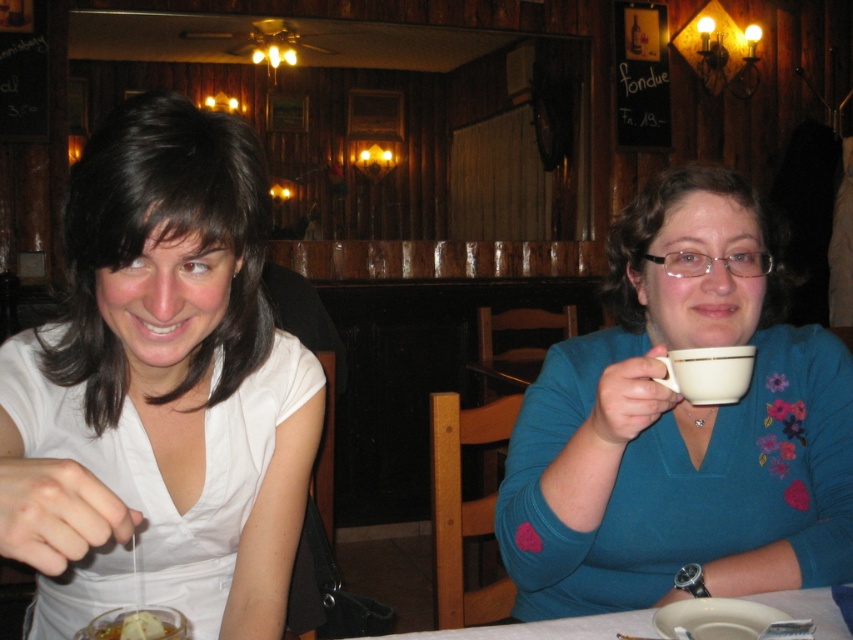
Question: Is white matte shirt at left below white porcelain mug at upper right?

Choices:
 (A) no
 (B) yes

Answer: (B)

Question: Which point is farther from the camera taking this photo?

Choices:
 (A) (822, 611)
 (B) (148, 609)
 (C) (152, 625)
 (D) (253, 541)

Answer: (D)

Question: Is white matte shirt at left below teal jersey at upper right?

Choices:
 (A) yes
 (B) no

Answer: (A)

Question: Which object appears closest to the camera in this image?

Choices:
 (A) white porcelain mug at upper right
 (B) white glossy table at lower center
 (C) translucent glass bowl at lower left

Answer: (C)

Question: Which point is farther to the camera?

Choices:
 (A) (467, 637)
 (B) (728, 388)
 (C) (67, 611)
 (D) (97, 621)

Answer: (C)

Question: Can you confirm if teal jersey at upper right is wider than white glossy table at lower center?

Choices:
 (A) no
 (B) yes

Answer: (A)